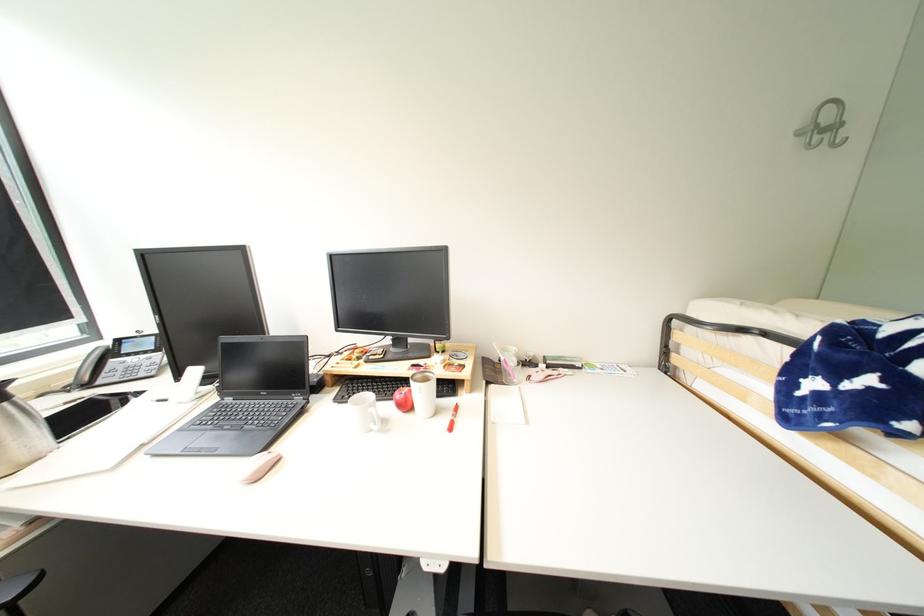
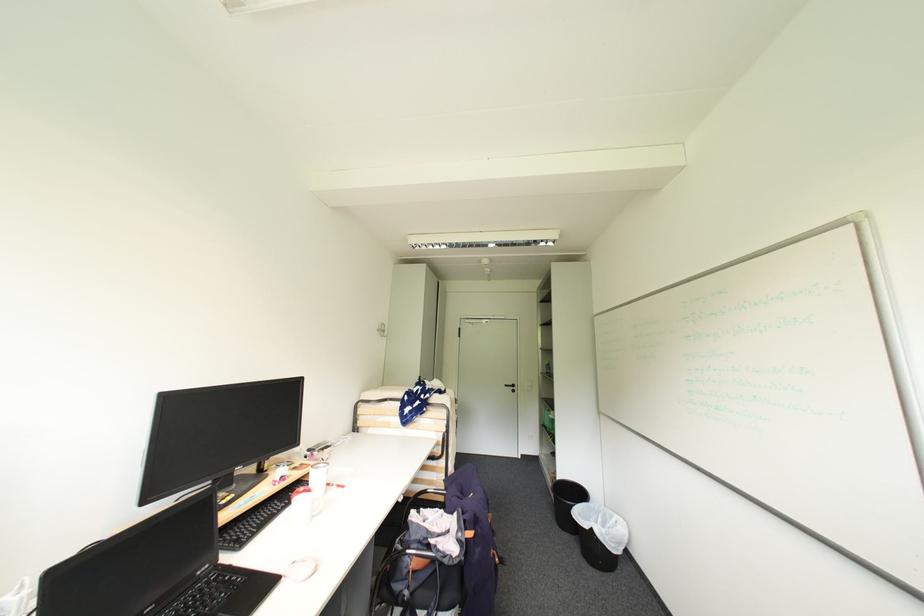
The point at (432, 567) is marked in the first image. Where is the corresponding point in the second image?

(407, 501)